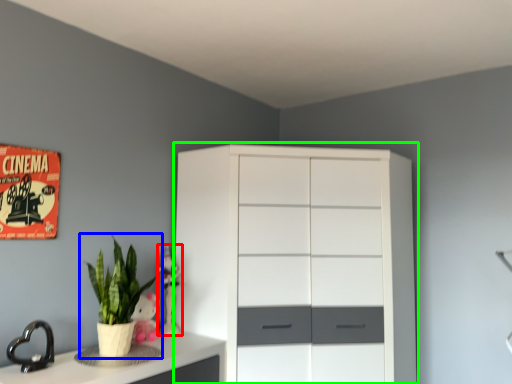
Question: Which object is positioned closest to toy (highlighted by a red box)? Select from houseplant (highlighted by a blue box) and chest of drawers (highlighted by a green box).

Choices:
 (A) houseplant
 (B) chest of drawers

Answer: (A)